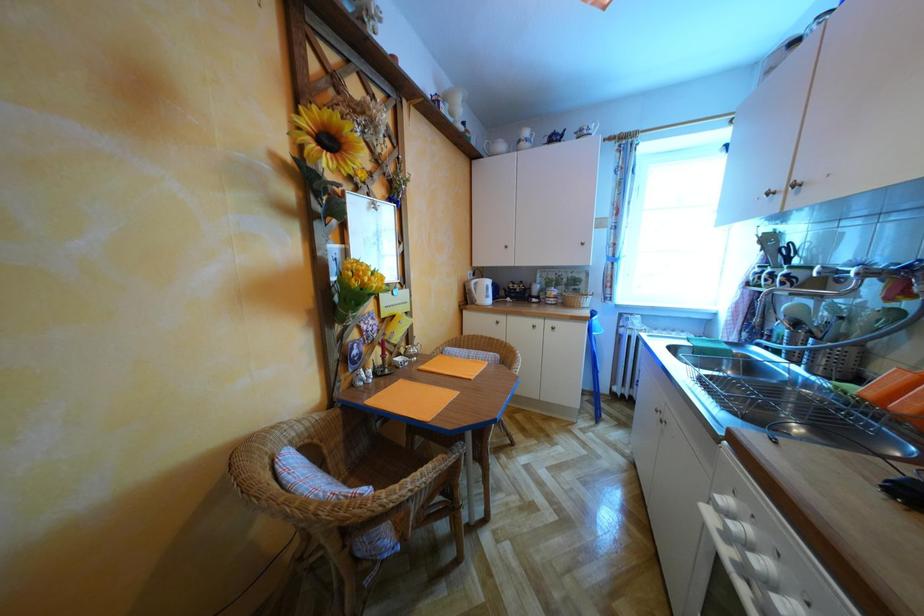
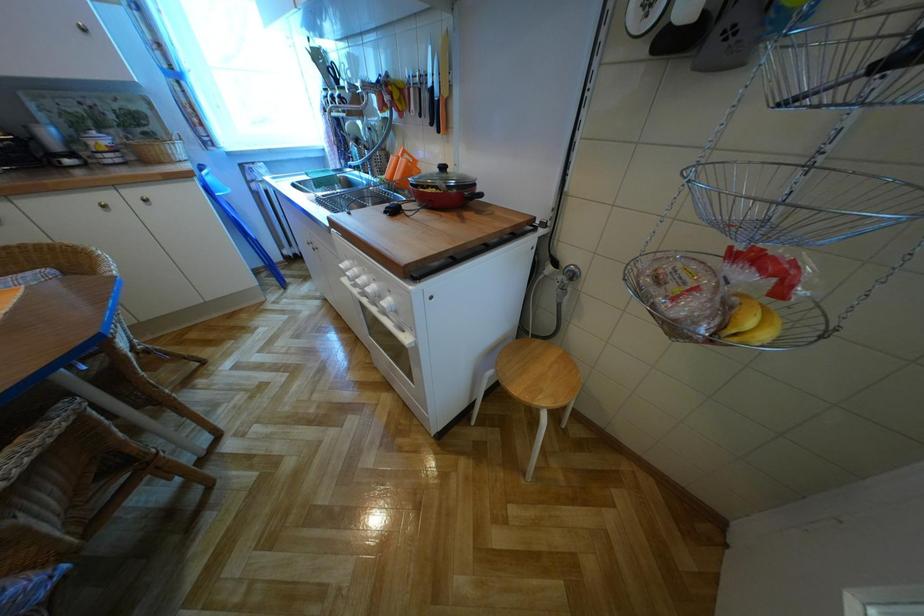
First-person continuous shooting, in which direction is the camera rotating?

The camera's rotation is toward right-down.